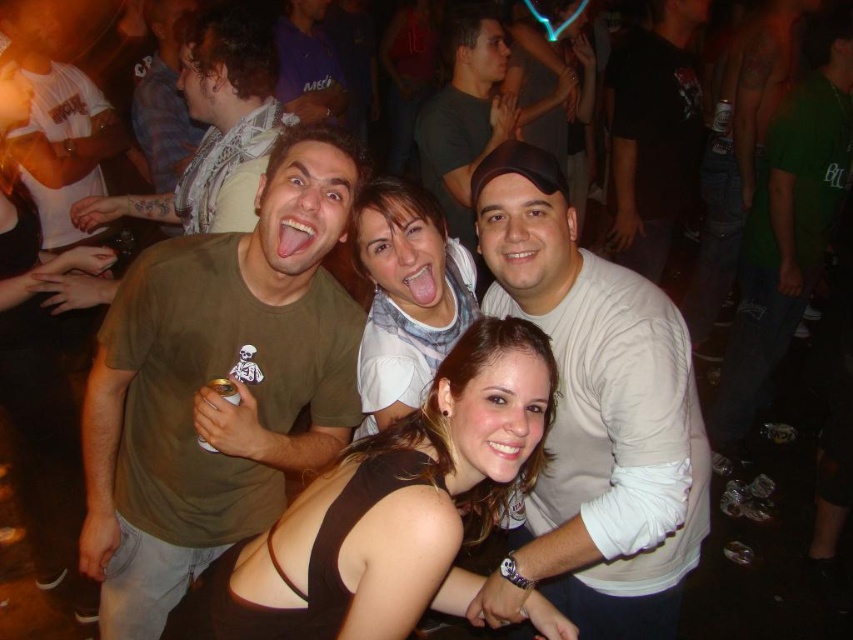
Question: Is green cotton shirt at right closer to the viewer compared to dark gray t-shirt at center?

Choices:
 (A) no
 (B) yes

Answer: (B)

Question: Which object is positioned closest to the white matte shirt at center?

Choices:
 (A) light brown scarf at upper left
 (B) white scarf at center

Answer: (B)

Question: Which point is farther to the camera?

Choices:
 (A) dark gray t-shirt at center
 (B) green cotton shirt at right
 (C) light brown scarf at upper left
 (D) matte green t-shirt at upper center

Answer: (A)

Question: Which object appears closest to the camera in this image?

Choices:
 (A) dark gray t-shirt at center
 (B) white scarf at center
 (C) green cotton shirt at right
 (D) green matte t-shirt at center

Answer: (D)

Question: Can you confirm if light brown scarf at upper left is bigger than matte green t-shirt at upper center?

Choices:
 (A) yes
 (B) no

Answer: (A)

Question: From the image, what is the correct spatial relationship of dark gray t-shirt at center in relation to matte green t-shirt at upper center?

Choices:
 (A) above
 (B) below

Answer: (A)